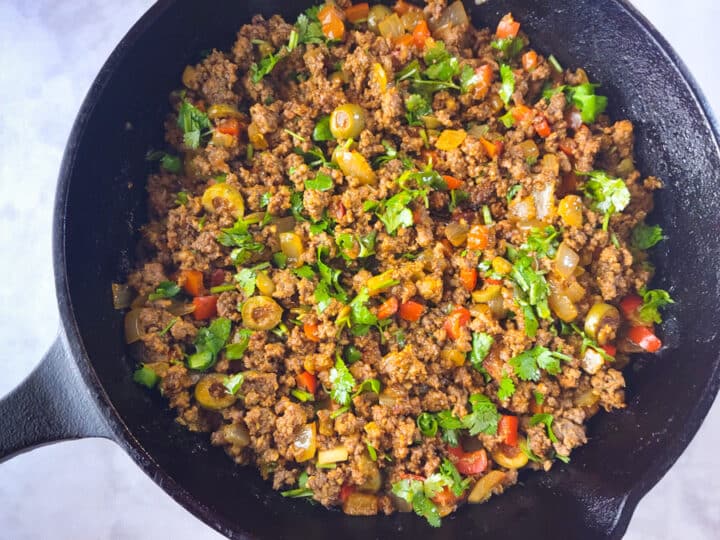
Identify the location of skillet handle. pos(32,420).